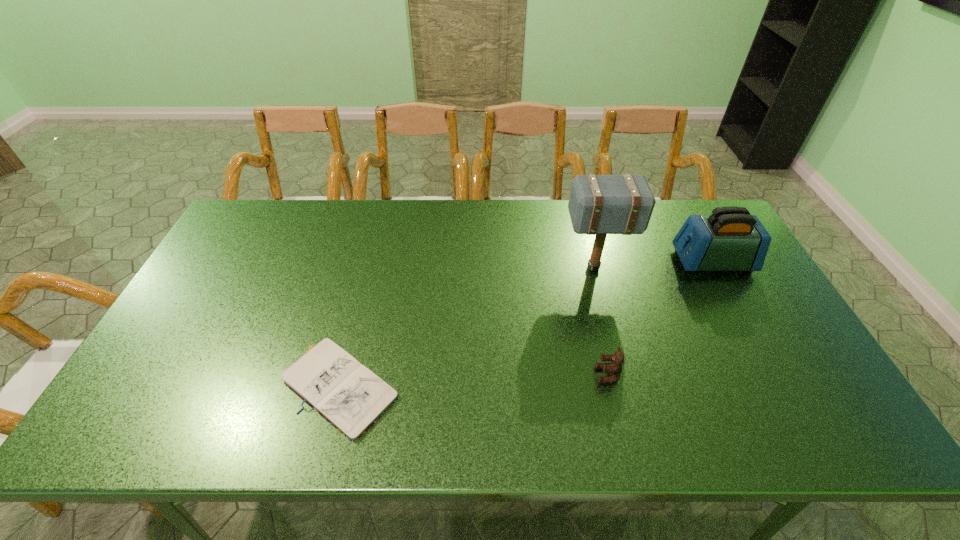
At what (x,y) coordinates should I click in order to perform the action: click on vacant region at the left edge of the desktop. Please return your answer as a coordinate pair (x, y). Image resolution: width=960 pixels, height=540 pixels. Looking at the image, I should click on (199, 298).

In order to click on vacant space at the right edge of the desktop in this screenshot , I will do `click(756, 296)`.

Where is `vacant space at the far left corner of the desktop`? vacant space at the far left corner of the desktop is located at coordinates (253, 217).

The height and width of the screenshot is (540, 960). What are the coordinates of `free space between the shortest object and the rightmost object` in the screenshot? It's located at (527, 324).

Where is `free area in between the shortest object and the second shortest object`? free area in between the shortest object and the second shortest object is located at coordinates (474, 380).

This screenshot has height=540, width=960. Identify the location of free point between the second tallest object and the shortest object. (527, 324).

Identify the location of empty space that is in between the mallet and the toaster. (653, 265).

Where is `empty space that is in between the mallet and the shortest object`? Image resolution: width=960 pixels, height=540 pixels. empty space that is in between the mallet and the shortest object is located at coordinates (468, 327).

This screenshot has height=540, width=960. Identify the location of blank region between the shortest object and the third shortest object. (527, 324).

Where is `empty location between the notebook and the tallest object`? empty location between the notebook and the tallest object is located at coordinates (468, 327).